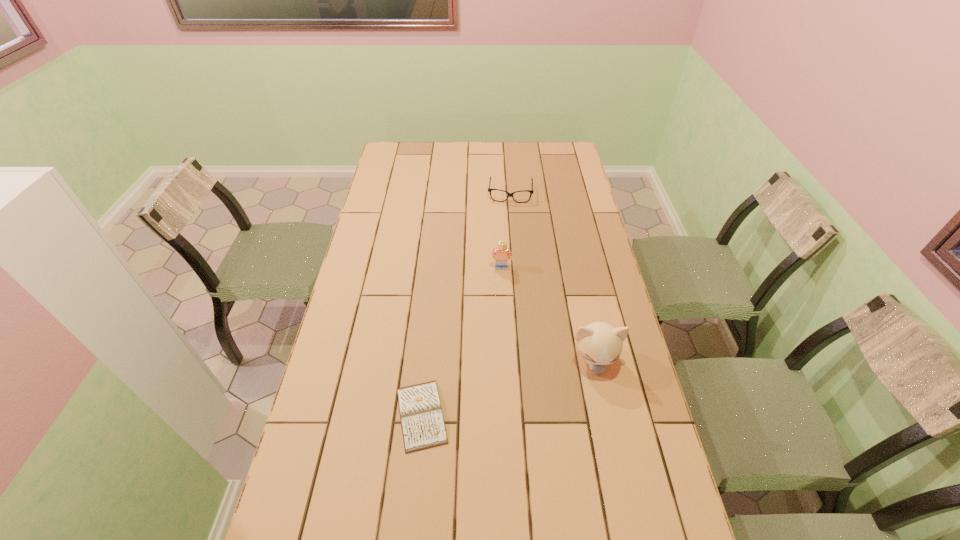
Where is `vacant space at the far left corner of the desktop`? This screenshot has width=960, height=540. vacant space at the far left corner of the desktop is located at coordinates (397, 161).

In order to click on blank space at the near left corner in this screenshot , I will do `click(294, 530)`.

This screenshot has height=540, width=960. In the image, there is a desktop. Identify the location of blank space at the far right corner. (560, 146).

You are a GUI agent. You are given a task and a screenshot of the screen. Output one action in this format:
    pyautogui.click(x=<x>, y=<y>)
    Task: Click on the vacant space that is in between the leftmost object and the farthest object
    The width and height of the screenshot is (960, 540).
    Given the screenshot: What is the action you would take?
    pyautogui.click(x=466, y=304)

I want to click on free space between the third shortest object and the diary, so click(x=462, y=341).

Find the location of a particular element. The width and height of the screenshot is (960, 540). empty location between the Lego and the third tallest object is located at coordinates (506, 230).

You are a GUI agent. You are given a task and a screenshot of the screen. Output one action in this format:
    pyautogui.click(x=<x>, y=<y>)
    Task: Click on the free space between the second shortest object and the third farthest object
    This screenshot has width=960, height=540.
    Given the screenshot: What is the action you would take?
    pyautogui.click(x=552, y=277)

Where is `empty space that is in between the spectacles and the tallest object`? The image size is (960, 540). empty space that is in between the spectacles and the tallest object is located at coordinates (552, 277).

Find the location of a particular element. The height and width of the screenshot is (540, 960). vacant area that lies between the farthest object and the leftmost object is located at coordinates (466, 304).

Where is `empty space that is in between the third shortest object and the tallest object`? This screenshot has height=540, width=960. empty space that is in between the third shortest object and the tallest object is located at coordinates (547, 314).